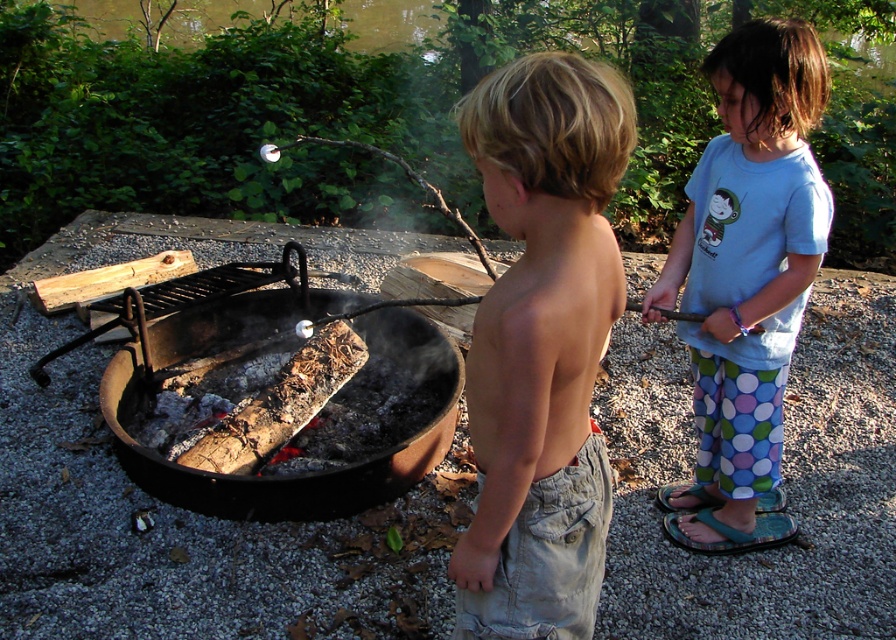
Consider the image. Is charred wood fire pit at center thinner than blue cotton shirt at upper right?

No.

Consider the image. Does charred wood fire pit at center appear under blue cotton shirt at upper right?

Indeed, charred wood fire pit at center is positioned under blue cotton shirt at upper right.

Where is `charred wood fire pit at center`? This screenshot has width=896, height=640. charred wood fire pit at center is located at coordinates (273, 394).

Does light brown hair at center appear under blue cotton shirt at upper right?

Correct, light brown hair at center is located below blue cotton shirt at upper right.

Which of these two, light brown hair at center or blue cotton shirt at upper right, stands shorter?

light brown hair at center

Where is `light brown hair at center`? light brown hair at center is located at coordinates (541, 346).

Can you confirm if light brown hair at center is positioned to the left of charred wood fire pit at center?

In fact, light brown hair at center is to the right of charred wood fire pit at center.

Is point (567, 582) positioned after point (341, 416)?

That is False.

Which is in front, point (556, 100) or point (119, 358)?

Point (556, 100) is in front.

The image size is (896, 640). I want to click on light brown hair at center, so click(x=541, y=346).